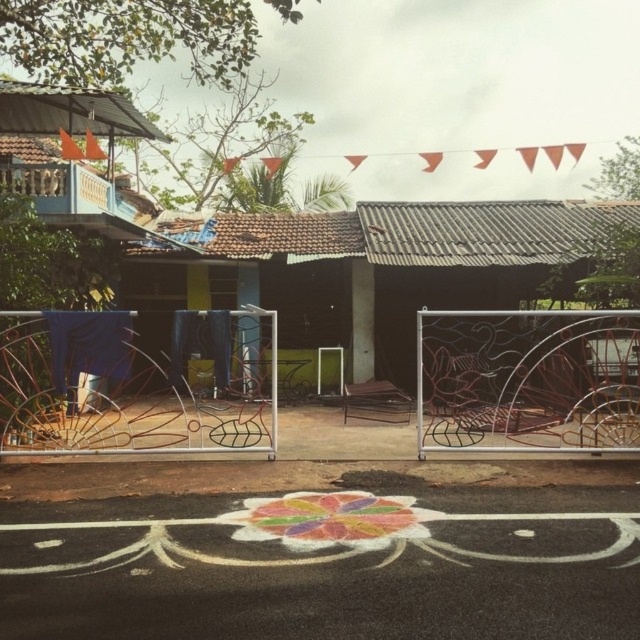
Can you confirm if brown corrugated metal hut at center is positioned below wooden chair at center?

No.

Who is more forward, [280,291] or [380,397]?

Point [380,397] is more forward.

I want to click on brown corrugated metal hut at center, so click(x=371, y=269).

Which of these two, blue painted wood hut at left or wooden chair at center, stands taller?

blue painted wood hut at left is taller.

Which is more to the left, blue painted wood hut at left or wooden chair at center?

From the viewer's perspective, blue painted wood hut at left appears more on the left side.

The height and width of the screenshot is (640, 640). What do you see at coordinates (72, 150) in the screenshot?
I see `blue painted wood hut at left` at bounding box center [72, 150].

Find the location of a particular element. This screenshot has width=640, height=640. blue painted wood hut at left is located at coordinates (72, 150).

Does brown corrugated metal hut at center have a lesser width compared to blue painted wood hut at left?

No, brown corrugated metal hut at center is not thinner than blue painted wood hut at left.

The height and width of the screenshot is (640, 640). Identify the location of brown corrugated metal hut at center. (371, 269).

Is point (337, 230) more distant than point (28, 96)?

Yes, point (337, 230) is behind point (28, 96).

Locate an element on the screen. Image resolution: width=640 pixels, height=640 pixels. brown corrugated metal hut at center is located at coordinates (371, 269).